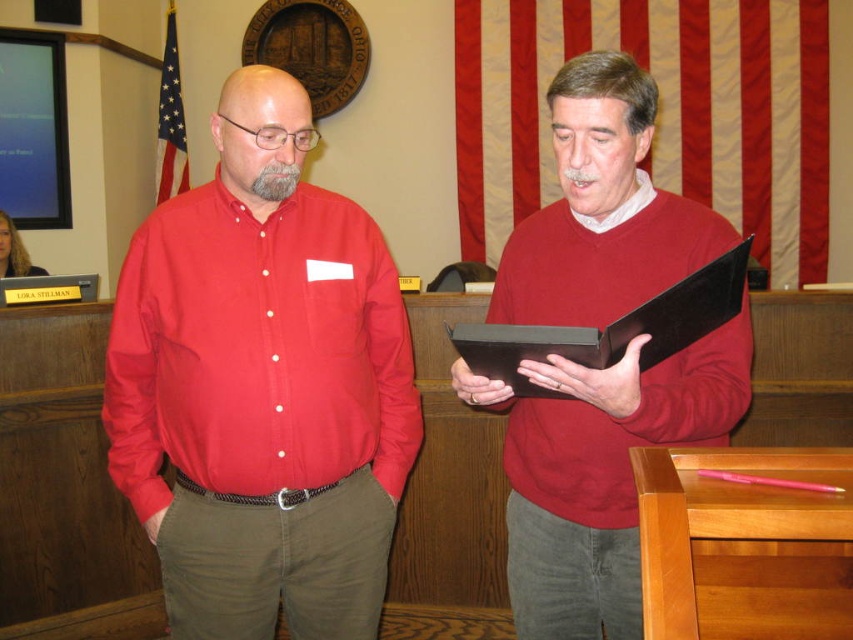
Between point (642, 81) and point (396, 484), which one is positioned in front?

Positioned in front is point (642, 81).

Which is behind, point (517, 438) or point (196, 198)?

The point (196, 198) is behind.

Locate an element on the screen. This screenshot has width=853, height=640. matte black folder at center is located at coordinates (599, 472).

Does matte black folder at center have a lesser height compared to black leather clipboard at center?

In fact, matte black folder at center may be taller than black leather clipboard at center.

Is point (532, 252) more distant than point (697, 305)?

Yes, it is.

Which is behind, point (654, 260) or point (659, 308)?

Positioned behind is point (654, 260).

Where is `matte black folder at center`? matte black folder at center is located at coordinates (599, 472).

Between point (271, 465) and point (532, 324), which one is positioned behind?

The point (271, 465) is more distant.

Looking at this image, is matte cotton shirt at left to the left of black leather clipboard at center from the viewer's perspective?

Indeed, matte cotton shirt at left is positioned on the left side of black leather clipboard at center.

This screenshot has height=640, width=853. Describe the element at coordinates (257, 349) in the screenshot. I see `matte cotton shirt at left` at that location.

This screenshot has height=640, width=853. Identify the location of matte cotton shirt at left. (257, 349).